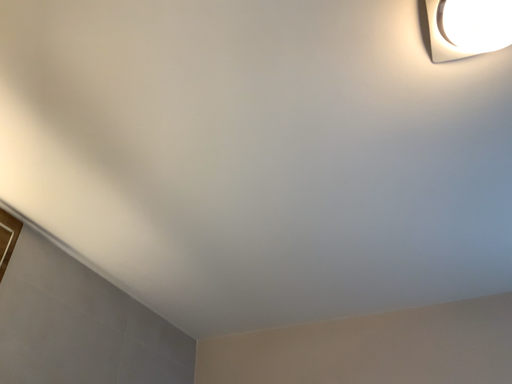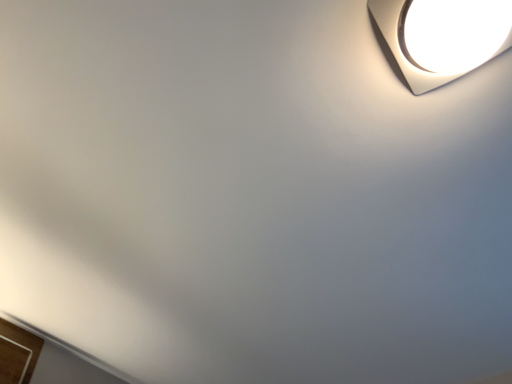
Question: Which way did the camera rotate in the video?

Choices:
 (A) rotated right
 (B) rotated left

Answer: (B)